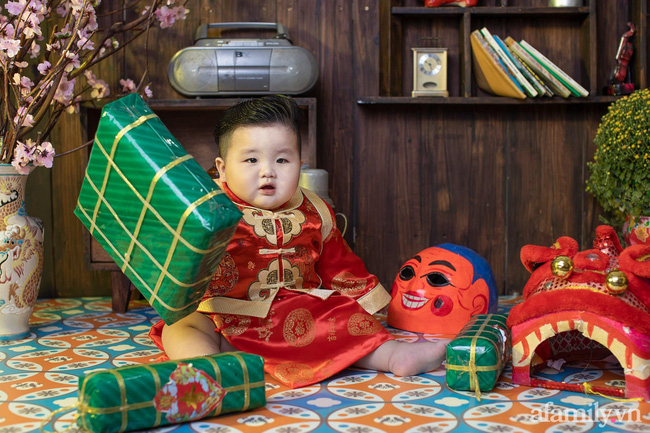
Where is `radio`? radio is located at coordinates (240, 64).